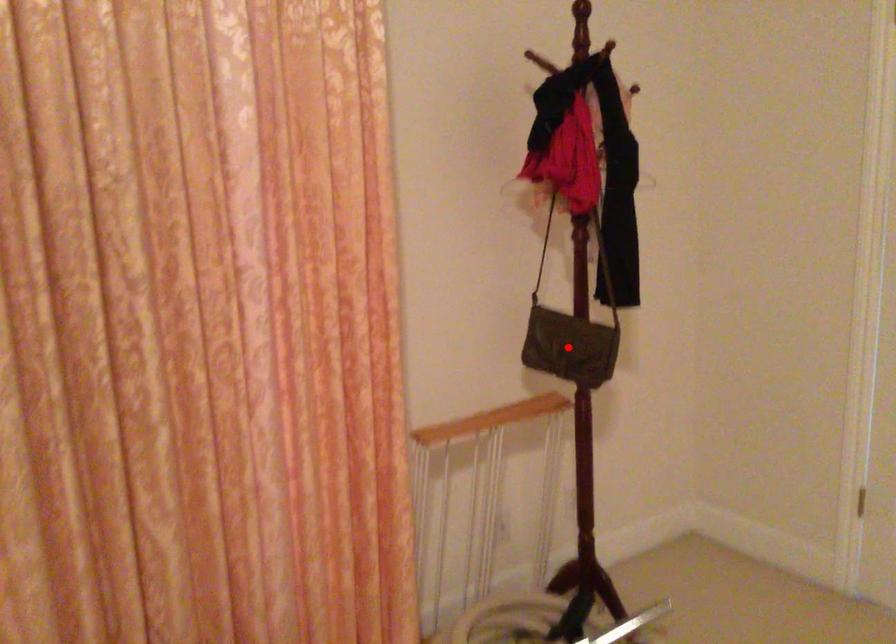
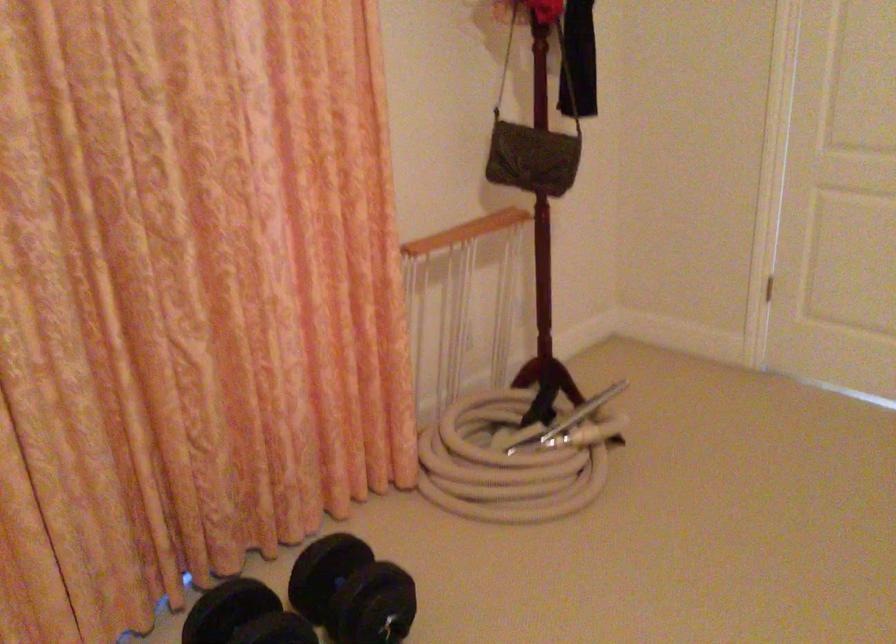
Where in the second image is the point corresponding to the highlighted location from the first image?

(531, 158)